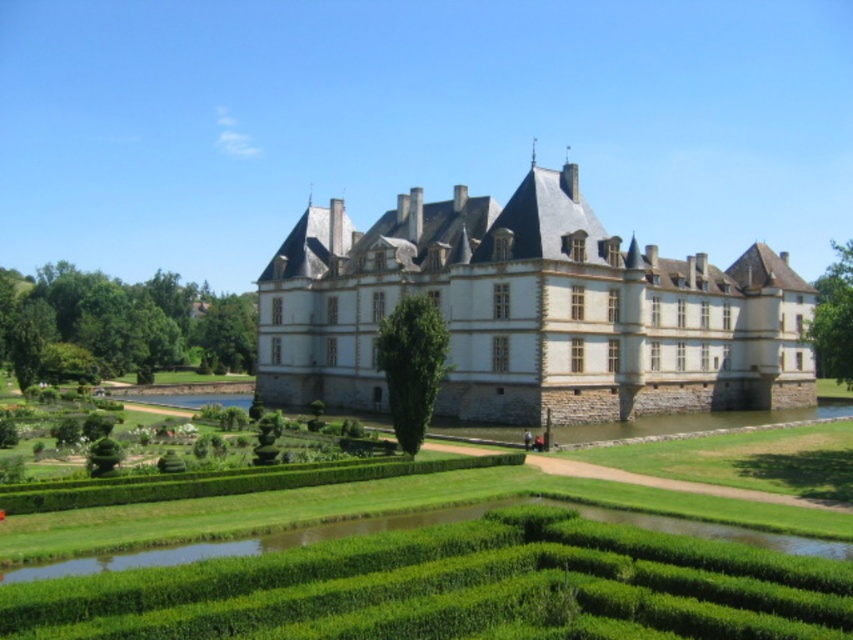
Question: Considering the relative positions of stone gray castle at center and green hedge at center in the image provided, where is stone gray castle at center located with respect to green hedge at center?

Choices:
 (A) above
 (B) below

Answer: (A)

Question: Does stone gray castle at center appear on the right side of green hedge at center?

Choices:
 (A) no
 (B) yes

Answer: (B)

Question: Which of the following is the closest to the observer?

Choices:
 (A) green leafy hedge at lower left
 (B) stone gray castle at center

Answer: (B)

Question: Which point is closer to the camera?

Choices:
 (A) (140, 292)
 (B) (463, 564)

Answer: (B)

Question: Based on their relative distances, which object is nearer to the green hedge at center?

Choices:
 (A) stone gray castle at center
 (B) green leafy hedge at lower left

Answer: (A)

Question: Is green hedge at center above green leafy hedge at lower left?

Choices:
 (A) no
 (B) yes

Answer: (A)